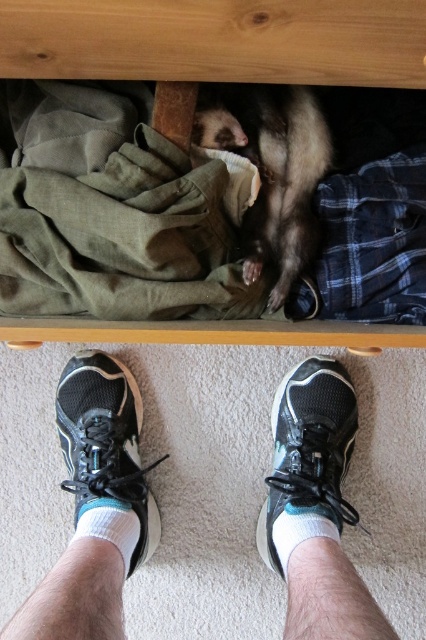
In the scene shown: Is black mesh sneakers at center taller than black mesh shoe at lower center?

Yes, black mesh sneakers at center is taller than black mesh shoe at lower center.

Which is above, black mesh sneakers at center or black mesh shoe at lower center?

black mesh shoe at lower center is higher up.

The width and height of the screenshot is (426, 640). What do you see at coordinates (94, 506) in the screenshot?
I see `black mesh sneakers at center` at bounding box center [94, 506].

What are the coordinates of `black mesh sneakers at center` in the screenshot? It's located at (94, 506).

Does black mesh shoe at center have a larger size compared to black mesh shoe at lower center?

Yes, black mesh shoe at center is bigger than black mesh shoe at lower center.

Who is higher up, black mesh shoe at center or black mesh shoe at lower center?

black mesh shoe at center

Does point (307, 515) come farther from viewer compared to point (100, 449)?

No, (307, 515) is closer to viewer.

This screenshot has width=426, height=640. In order to click on black mesh shoe at center in this screenshot , I will do `click(308, 458)`.

Does fuzzy brown ferret at center appear over black mesh shoe at center?

Yes.

Which of these two, fuzzy brown ferret at center or black mesh shoe at center, stands taller?

black mesh shoe at center is taller.

Who is more distant from viewer, (x=259, y=225) or (x=299, y=449)?

Positioned behind is point (x=299, y=449).

The width and height of the screenshot is (426, 640). I want to click on fuzzy brown ferret at center, so click(270, 168).